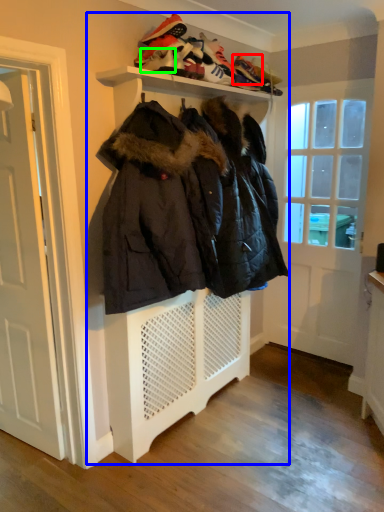
Question: Which object is the farthest from shoe (highlighted by a red box)? Choose among these: closet (highlighted by a blue box) or shoe (highlighted by a green box).

Choices:
 (A) closet
 (B) shoe

Answer: (A)